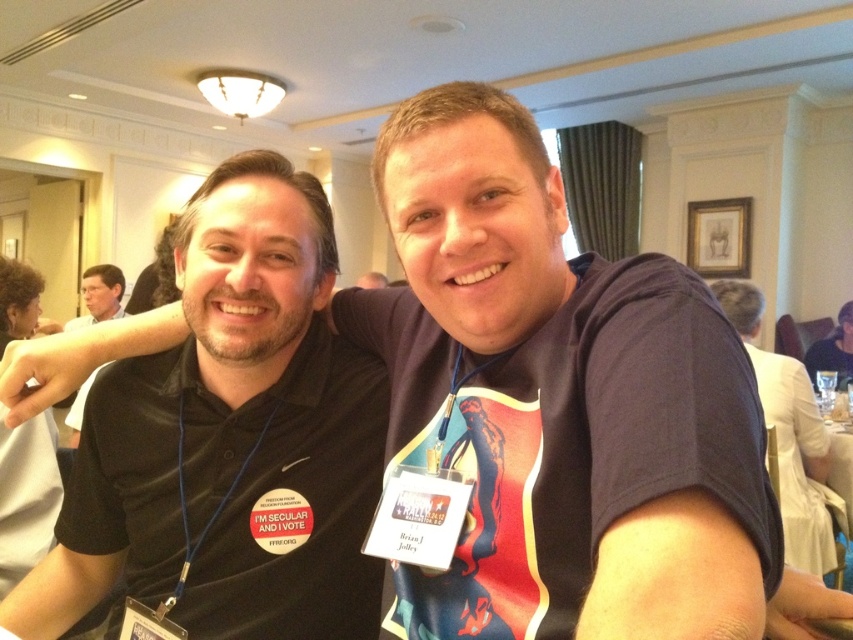
You are organizing a photo shoot and need to ensure that the black matte shirt at left and the black shirt at left are clearly visible in the final image. Given their size difference, which one might require closer framing to ensure visibility?

The black matte shirt at left has a smaller size compared to the black shirt at left, so it might require closer framing to ensure visibility.

You are standing in the room and see the point at coordinates (99, 296). Which object is this point located on?

The point at coordinates (99, 296) is located on the black shirt at left.